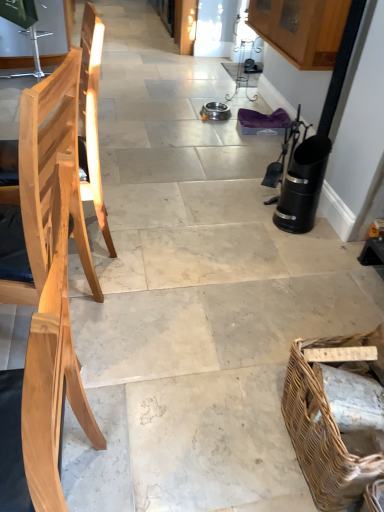
Question: In terms of height, does natural wood chair at left, acting as the first chair starting from the bottom, look taller or shorter compared to natural wood chair at left, which ranks as the second chair in front-to-back order?

Choices:
 (A) short
 (B) tall

Answer: (B)

Question: Looking at their shapes, would you say natural wood chair at left, acting as the first chair starting from the bottom, is wider or thinner than natural wood chair at left, the first chair positioned from the top?

Choices:
 (A) wide
 (B) thin

Answer: (B)

Question: Based on their relative distances, which object is farther from the natural wood chair at left, the second chair when ordered from back to front?

Choices:
 (A) natural wood chair at left, marked as the first chair in a back-to-front arrangement
 (B) brown woven picnic basket at lower right

Answer: (B)

Question: Which is farther from the natural wood chair at left, the 1th chair when ordered from front to back?

Choices:
 (A) brown woven picnic basket at lower right
 (B) natural wood chair at left, marked as the first chair in a back-to-front arrangement

Answer: (A)